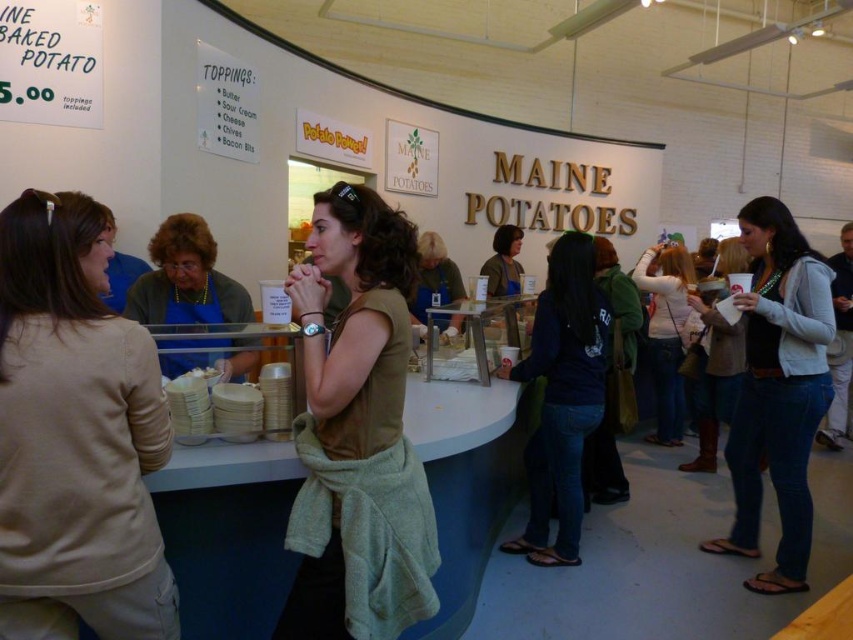
Does point (177, 358) come closer to viewer compared to point (715, 358)?

Yes, it is.

Can you confirm if blue apron at center is positioned below matte white cup at center right?

Incorrect, blue apron at center is not positioned below matte white cup at center right.

The image size is (853, 640). What do you see at coordinates (186, 280) in the screenshot? I see `blue apron at center` at bounding box center [186, 280].

Where is `blue apron at center`? The image size is (853, 640). blue apron at center is located at coordinates (186, 280).

Find the location of `green matte shirt at center`. green matte shirt at center is located at coordinates (357, 429).

Is green matte shirt at center bigger than green cotton hoodie at center?

Incorrect, green matte shirt at center is not larger than green cotton hoodie at center.

Which is behind, point (309, 604) or point (614, 346)?

The point (614, 346) is behind.

The image size is (853, 640). What are the coordinates of `green matte shirt at center` in the screenshot? It's located at (357, 429).

Where is `green cotton hoodie at center`? This screenshot has height=640, width=853. green cotton hoodie at center is located at coordinates (613, 381).

Who is positioned more to the right, green cotton hoodie at center or white matte shirt at center?

white matte shirt at center is more to the right.

Is point (627, 339) positioned behind point (677, 442)?

No, (627, 339) is closer to viewer.

Where is `green cotton hoodie at center`? This screenshot has width=853, height=640. green cotton hoodie at center is located at coordinates [x=613, y=381].